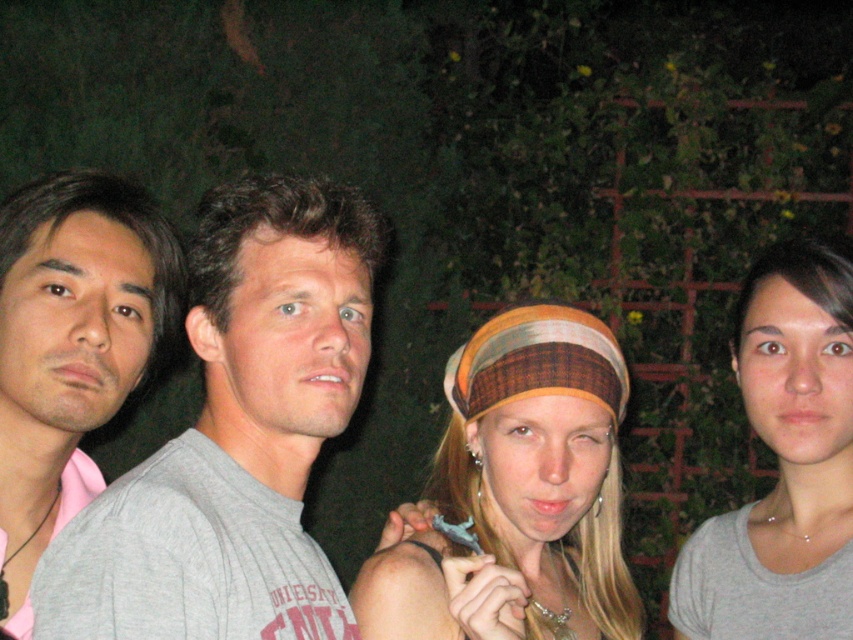
Question: Is gray ribbed shirt at left wider than gray matte shirt at right?

Choices:
 (A) no
 (B) yes

Answer: (B)

Question: Which of the following is the closest to the observer?

Choices:
 (A) (28, 312)
 (B) (262, 216)
 (C) (744, 326)
 (D) (473, 362)

Answer: (B)

Question: Which point is closer to the camera taking this photo?

Choices:
 (A) (381, 566)
 (B) (206, 332)
 (C) (70, 460)
 (D) (744, 337)

Answer: (B)

Question: Can you confirm if matte gray shirt at left is positioned above gray matte shirt at right?

Choices:
 (A) yes
 (B) no

Answer: (A)

Question: Which point is farther from the camera taking this photo?

Choices:
 (A) (366, 332)
 (B) (4, 385)
 (C) (830, 282)
 (D) (444, 600)

Answer: (C)

Question: Observing the image, what is the correct spatial positioning of matte gray shirt at left in reference to gray matte shirt at right?

Choices:
 (A) below
 (B) above

Answer: (B)